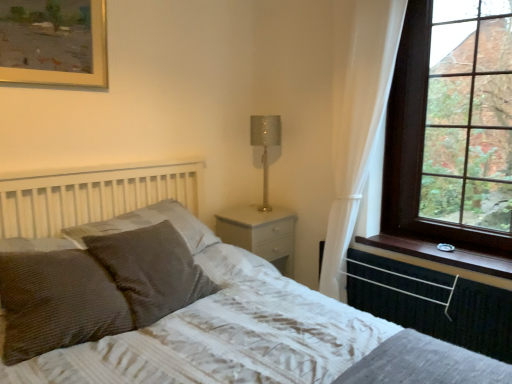
Question: From a real-world perspective, is gold-framed painting at upper left on black rubber radiator at lower right?

Choices:
 (A) no
 (B) yes

Answer: (B)

Question: Can you confirm if gold-framed painting at upper left is bigger than black rubber radiator at lower right?

Choices:
 (A) yes
 (B) no

Answer: (B)

Question: Would you consider gold-framed painting at upper left to be distant from black rubber radiator at lower right?

Choices:
 (A) no
 (B) yes

Answer: (B)

Question: Considering the relative positions of gold-framed painting at upper left and black rubber radiator at lower right in the image provided, is gold-framed painting at upper left behind black rubber radiator at lower right?

Choices:
 (A) no
 (B) yes

Answer: (A)

Question: Is gold-framed painting at upper left to the left of black rubber radiator at lower right from the viewer's perspective?

Choices:
 (A) yes
 (B) no

Answer: (A)

Question: From the image's perspective, does gold-framed painting at upper left appear lower than black rubber radiator at lower right?

Choices:
 (A) no
 (B) yes

Answer: (A)

Question: Does white glossy nightstand at center have a larger size compared to textured brown pillow at center-left, the 3th pillow when ordered from front to back?

Choices:
 (A) yes
 (B) no

Answer: (A)

Question: Is white glossy nightstand at center at the right side of textured brown pillow at center-left, which ranks as the first pillow in back-to-front order?

Choices:
 (A) yes
 (B) no

Answer: (A)

Question: From a real-world perspective, is white glossy nightstand at center positioned under textured brown pillow at center-left, which ranks as the first pillow in back-to-front order, based on gravity?

Choices:
 (A) yes
 (B) no

Answer: (A)

Question: Is white glossy nightstand at center with textured brown pillow at center-left, which ranks as the first pillow in back-to-front order?

Choices:
 (A) yes
 (B) no

Answer: (B)

Question: From the image's perspective, is white glossy nightstand at center below textured brown pillow at center-left, the 3th pillow when ordered from front to back?

Choices:
 (A) yes
 (B) no

Answer: (A)

Question: Is white glossy nightstand at center wider than textured brown pillow at center-left, the 3th pillow when ordered from front to back?

Choices:
 (A) yes
 (B) no

Answer: (A)

Question: From the image's perspective, is brown wooden window at upper right under textured gray bed at center?

Choices:
 (A) yes
 (B) no

Answer: (B)